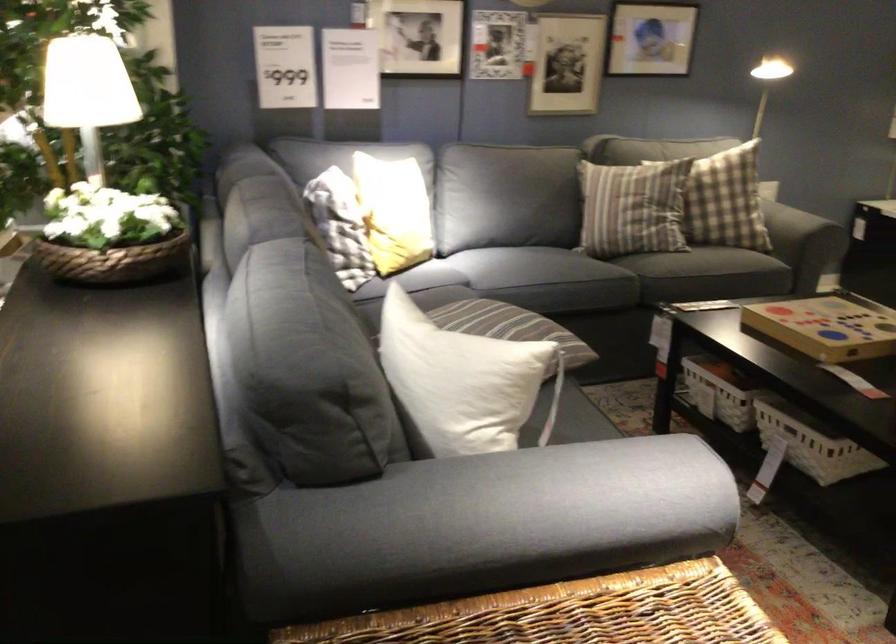
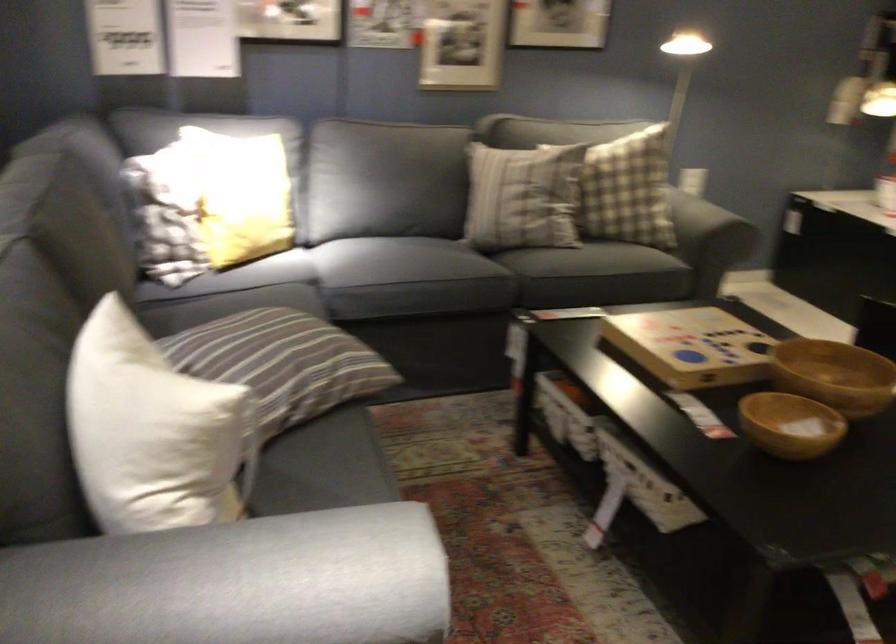
What movement of the cameraman would produce the second image?

The cameraman walked toward right, forward.